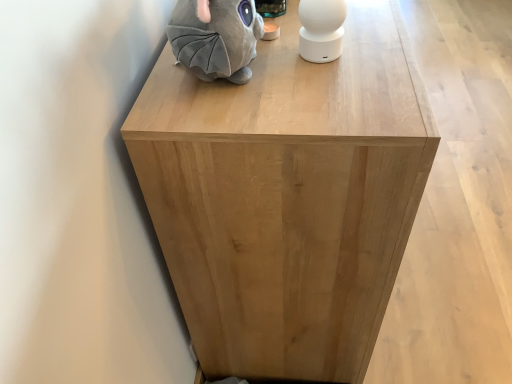
The image size is (512, 384). In order to click on free space in front of gray plush toy at upper left, the first toy viewed from the left in this screenshot , I will do `click(248, 121)`.